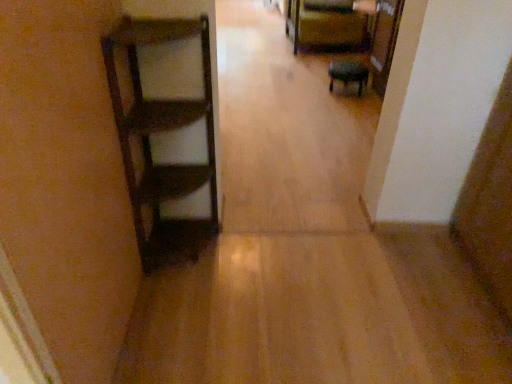
Question: From their relative heights in the image, would you say matte black stool at center, which is the first furniture in bottom-to-top order, is taller or shorter than matte brown chair at upper center, marked as the second furniture in a front-to-back arrangement?

Choices:
 (A) short
 (B) tall

Answer: (A)

Question: Considering the positions of matte black stool at center, the second furniture viewed from the back, and matte brown chair at upper center, which is the 1th furniture from top to bottom, in the image, is matte black stool at center, the second furniture viewed from the back, wider or thinner than matte brown chair at upper center, which is the 1th furniture from top to bottom,?

Choices:
 (A) thin
 (B) wide

Answer: (A)

Question: In the image, is matte black stool at center, which is the first furniture in bottom-to-top order, on the left side or the right side of matte brown chair at upper center, the second furniture positioned from the bottom?

Choices:
 (A) right
 (B) left

Answer: (A)

Question: Would you say matte brown chair at upper center, which is the 1th furniture from top to bottom, is inside or outside matte black stool at center, marked as the 1th furniture in a front-to-back arrangement?

Choices:
 (A) outside
 (B) inside

Answer: (A)

Question: Based on their positions, is matte brown chair at upper center, positioned as the first furniture in back-to-front order, located to the left or right of matte black stool at center, the second furniture viewed from the back?

Choices:
 (A) left
 (B) right

Answer: (A)

Question: In the image, is matte brown chair at upper center, positioned as the first furniture in back-to-front order, positioned in front of or behind matte black stool at center, the second furniture viewed from the back?

Choices:
 (A) front
 (B) behind

Answer: (B)

Question: Is point (326, 16) positioned closer to the camera than point (338, 69)?

Choices:
 (A) closer
 (B) farther

Answer: (B)